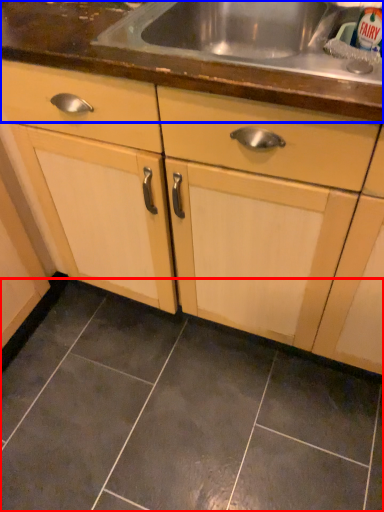
Question: Which object is closer to the camera taking this photo, ceramic tile (highlighted by a red box) or countertop (highlighted by a blue box)?

Choices:
 (A) ceramic tile
 (B) countertop

Answer: (B)